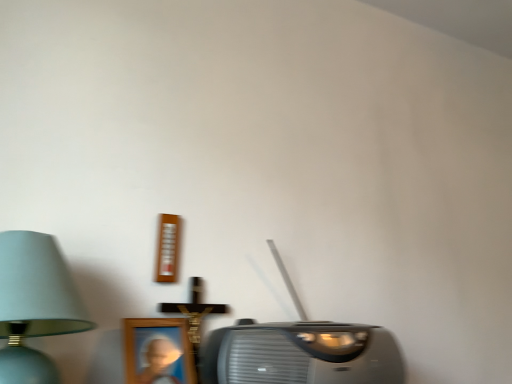
Question: Is light blue fabric lampshade at left aimed at metallic gray stereo at center?

Choices:
 (A) no
 (B) yes

Answer: (A)

Question: Is the position of light blue fabric lampshade at left less distant than that of metallic gray stereo at center?

Choices:
 (A) no
 (B) yes

Answer: (B)

Question: Is light blue fabric lampshade at left facing away from metallic gray stereo at center?

Choices:
 (A) yes
 (B) no

Answer: (B)

Question: Is light blue fabric lampshade at left thinner than metallic gray stereo at center?

Choices:
 (A) no
 (B) yes

Answer: (A)

Question: Considering the relative positions of light blue fabric lampshade at left and metallic gray stereo at center in the image provided, is light blue fabric lampshade at left to the right of metallic gray stereo at center from the viewer's perspective?

Choices:
 (A) yes
 (B) no

Answer: (B)

Question: Is light blue fabric lampshade at left completely or partially outside of metallic gray stereo at center?

Choices:
 (A) no
 (B) yes

Answer: (B)

Question: Does metallic gray stereo at center have a larger size compared to light blue fabric lampshade at left?

Choices:
 (A) yes
 (B) no

Answer: (A)

Question: Does metallic gray stereo at center have a greater width compared to light blue fabric lampshade at left?

Choices:
 (A) no
 (B) yes

Answer: (A)

Question: Is the depth of metallic gray stereo at center less than that of light blue fabric lampshade at left?

Choices:
 (A) no
 (B) yes

Answer: (A)

Question: Considering the relative sizes of metallic gray stereo at center and light blue fabric lampshade at left in the image provided, is metallic gray stereo at center thinner than light blue fabric lampshade at left?

Choices:
 (A) yes
 (B) no

Answer: (A)

Question: Does metallic gray stereo at center turn towards light blue fabric lampshade at left?

Choices:
 (A) yes
 (B) no

Answer: (B)

Question: From a real-world perspective, is metallic gray stereo at center positioned over light blue fabric lampshade at left based on gravity?

Choices:
 (A) yes
 (B) no

Answer: (B)

Question: From the image's perspective, is metallic gray stereo at center above or below light blue fabric lampshade at left?

Choices:
 (A) below
 (B) above

Answer: (A)